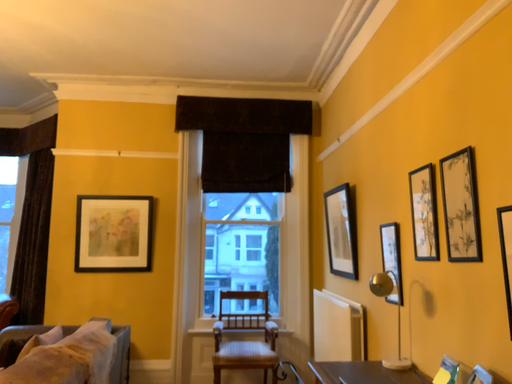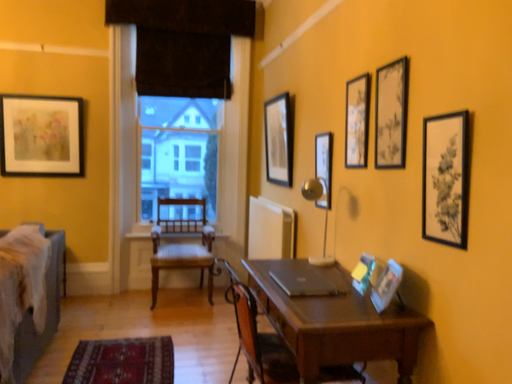
Question: Which way did the camera rotate in the video?

Choices:
 (A) rotated left
 (B) rotated right

Answer: (B)